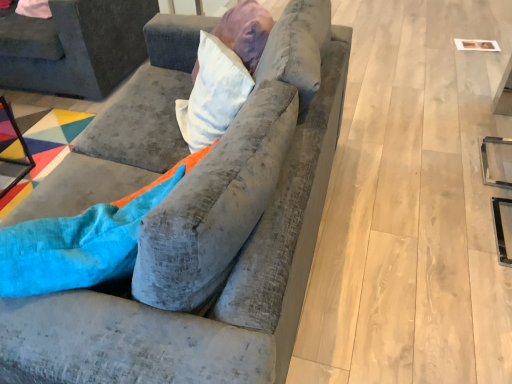
Question: Is velvet gray couch at center, which is counted as the first studio couch, starting from the right, inside the boundaries of velvet gray couch at upper left, marked as the second studio couch in a front-to-back arrangement, or outside?

Choices:
 (A) outside
 (B) inside

Answer: (A)

Question: From a real-world perspective, is velvet gray couch at center, the 2th studio couch positioned from the back, positioned above or below velvet gray couch at upper left, which ranks as the first studio couch in left-to-right order?

Choices:
 (A) below
 (B) above

Answer: (B)

Question: From the image's perspective, is velvet gray couch at center, acting as the 1th studio couch starting from the front, located above or below velvet gray couch at upper left, marked as the 2th studio couch in a right-to-left arrangement?

Choices:
 (A) above
 (B) below

Answer: (B)

Question: From a real-world perspective, is velvet gray couch at upper left, which ranks as the first studio couch in left-to-right order, above or below velvet gray couch at center, the 2th studio couch positioned from the back?

Choices:
 (A) below
 (B) above

Answer: (A)

Question: Is velvet gray couch at upper left, which ranks as the first studio couch in left-to-right order, situated inside velvet gray couch at center, acting as the 1th studio couch starting from the front, or outside?

Choices:
 (A) inside
 (B) outside

Answer: (B)

Question: Based on their positions, is velvet gray couch at upper left, which ranks as the first studio couch in left-to-right order, located to the left or right of velvet gray couch at center, which is counted as the first studio couch, starting from the right?

Choices:
 (A) left
 (B) right

Answer: (A)

Question: Considering their positions, is velvet gray couch at upper left, marked as the second studio couch in a front-to-back arrangement, located in front of or behind velvet gray couch at center, the 2th studio couch positioned from the back?

Choices:
 (A) behind
 (B) front

Answer: (A)